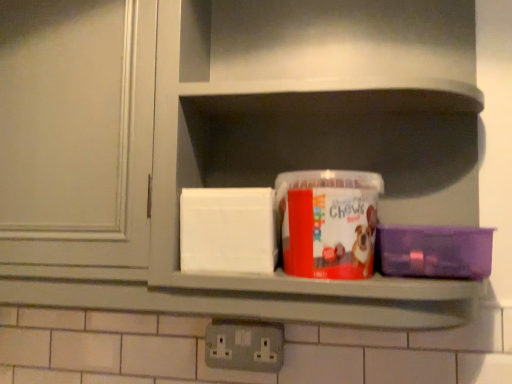
The height and width of the screenshot is (384, 512). What do you see at coordinates (329, 222) in the screenshot?
I see `translucent plastic container at center, which is the 2th box in right-to-left order` at bounding box center [329, 222].

Find the location of a particular element. The width and height of the screenshot is (512, 384). purple plastic container at right, positioned as the second box in left-to-right order is located at coordinates (434, 251).

Image resolution: width=512 pixels, height=384 pixels. Identify the location of translucent plastic container at center, which is the 2th box in right-to-left order. (329, 222).

Is point (280, 354) closer to viewer compared to point (222, 185)?

Yes, it is in front of point (222, 185).

Is gray plastic electrical outlet at lower center looking in the opposite direction of matte plastic container at center?

No, gray plastic electrical outlet at lower center's orientation is not away from matte plastic container at center.

Would you consider gray plastic electrical outlet at lower center to be distant from matte plastic container at center?

No, gray plastic electrical outlet at lower center is in close proximity to matte plastic container at center.

Considering the relative sizes of matte plastic container at center and translucent plastic container at center, which is the 2th box in right-to-left order, in the image provided, is matte plastic container at center bigger than translucent plastic container at center, which is the 2th box in right-to-left order,?

Yes, matte plastic container at center is bigger than translucent plastic container at center, which is the 2th box in right-to-left order.

Are matte plastic container at center and translucent plastic container at center, which is the 2th box in right-to-left order, far apart?

No.

From a real-world perspective, does matte plastic container at center stand above translucent plastic container at center, the 1th box positioned from the left?

Indeed, from a real-world perspective, matte plastic container at center stands above translucent plastic container at center, the 1th box positioned from the left.

Is matte plastic container at center to the right of gray plastic electrical outlet at lower center from the viewer's perspective?

Correct, you'll find matte plastic container at center to the right of gray plastic electrical outlet at lower center.

Is gray plastic electrical outlet at lower center completely or partially inside matte plastic container at center?

No, gray plastic electrical outlet at lower center is located outside of matte plastic container at center.

Is matte plastic container at center positioned far away from gray plastic electrical outlet at lower center?

matte plastic container at center is actually quite close to gray plastic electrical outlet at lower center.

From the image's perspective, which is below, matte plastic container at center or gray plastic electrical outlet at lower center?

gray plastic electrical outlet at lower center, from the image's perspective.

Based on the photo, could you measure the distance between matte plastic container at center and purple plastic container at right, positioned as the second box in left-to-right order?

matte plastic container at center is 7.55 inches from purple plastic container at right, positioned as the second box in left-to-right order.

Is matte plastic container at center in front of or behind purple plastic container at right, which appears as the 1th box when viewed from the right, in the image?

In the image, matte plastic container at center appears in front of purple plastic container at right, which appears as the 1th box when viewed from the right.

Considering the sizes of matte plastic container at center and purple plastic container at right, positioned as the second box in left-to-right order, in the image, is matte plastic container at center bigger or smaller than purple plastic container at right, positioned as the second box in left-to-right order,?

In the image, matte plastic container at center appears to be larger than purple plastic container at right, positioned as the second box in left-to-right order.

Are matte plastic container at center and purple plastic container at right, which appears as the 1th box when viewed from the right, beside each other?

No, matte plastic container at center is not making contact with purple plastic container at right, which appears as the 1th box when viewed from the right.

From a real-world perspective, relative to matte plastic container at center, is translucent plastic container at center, which is the 2th box in right-to-left order, vertically above or below?

From a real-world perspective, translucent plastic container at center, which is the 2th box in right-to-left order, is physically below matte plastic container at center.

Is translucent plastic container at center, the 1th box positioned from the left, touching matte plastic container at center?

No, translucent plastic container at center, the 1th box positioned from the left, is not with matte plastic container at center.

From the image's perspective, is translucent plastic container at center, which is the 2th box in right-to-left order, positioned above or below matte plastic container at center?

translucent plastic container at center, which is the 2th box in right-to-left order, is situated lower than matte plastic container at center in the image.

Is translucent plastic container at center, which is the 2th box in right-to-left order, turned away from gray plastic electrical outlet at lower center?

translucent plastic container at center, which is the 2th box in right-to-left order, does not have its back to gray plastic electrical outlet at lower center.

Is translucent plastic container at center, which is the 2th box in right-to-left order, at the left side of gray plastic electrical outlet at lower center?

Incorrect, translucent plastic container at center, which is the 2th box in right-to-left order, is not on the left side of gray plastic electrical outlet at lower center.

This screenshot has width=512, height=384. I want to click on electric outlet that appears on the left of translucent plastic container at center, the 1th box positioned from the left, so click(244, 346).

How far apart are translucent plastic container at center, which is the 2th box in right-to-left order, and gray plastic electrical outlet at lower center?

translucent plastic container at center, which is the 2th box in right-to-left order, is 9.00 inches from gray plastic electrical outlet at lower center.

Can gray plastic electrical outlet at lower center be found inside purple plastic container at right, which appears as the 1th box when viewed from the right?

Actually, gray plastic electrical outlet at lower center is outside purple plastic container at right, which appears as the 1th box when viewed from the right.

From the image's perspective, is purple plastic container at right, positioned as the second box in left-to-right order, on top of gray plastic electrical outlet at lower center?

Yes, from the image's perspective, purple plastic container at right, positioned as the second box in left-to-right order, is on top of gray plastic electrical outlet at lower center.

Considering the positions of objects purple plastic container at right, positioned as the second box in left-to-right order, and gray plastic electrical outlet at lower center in the image provided, who is more to the right, purple plastic container at right, positioned as the second box in left-to-right order, or gray plastic electrical outlet at lower center?

purple plastic container at right, positioned as the second box in left-to-right order, is more to the right.

Is purple plastic container at right, positioned as the second box in left-to-right order, oriented away from gray plastic electrical outlet at lower center?

purple plastic container at right, positioned as the second box in left-to-right order, is not turned away from gray plastic electrical outlet at lower center.

Where is `cabinet that appears on the right of gray plastic electrical outlet at lower center`? cabinet that appears on the right of gray plastic electrical outlet at lower center is located at coordinates (314, 163).

The image size is (512, 384). I want to click on cabinet above the translucent plastic container at center, which is the 2th box in right-to-left order (from a real-world perspective), so 314,163.

Which object lies further to the anchor point gray plastic electrical outlet at lower center, translucent plastic container at center, the 1th box positioned from the left, or matte plastic container at center?

matte plastic container at center.

Based on their spatial positions, is purple plastic container at right, positioned as the second box in left-to-right order, or matte plastic container at center further from gray plastic electrical outlet at lower center?

matte plastic container at center.

When comparing their distances from purple plastic container at right, positioned as the second box in left-to-right order, does matte plastic container at center or translucent plastic container at center, which is the 2th box in right-to-left order, seem further?

matte plastic container at center.

When comparing their distances from matte plastic container at center, does translucent plastic container at center, the 1th box positioned from the left, or purple plastic container at right, which appears as the 1th box when viewed from the right, seem further?

purple plastic container at right, which appears as the 1th box when viewed from the right, is positioned further to the anchor matte plastic container at center.

Based on their spatial positions, is matte plastic container at center or purple plastic container at right, which appears as the 1th box when viewed from the right, further from translucent plastic container at center, the 1th box positioned from the left?

matte plastic container at center.

Considering their positions, is translucent plastic container at center, which is the 2th box in right-to-left order, positioned closer to purple plastic container at right, positioned as the second box in left-to-right order, than matte plastic container at center?

Among the two, translucent plastic container at center, which is the 2th box in right-to-left order, is located nearer to purple plastic container at right, positioned as the second box in left-to-right order.

When comparing their distances from purple plastic container at right, which appears as the 1th box when viewed from the right, does gray plastic electrical outlet at lower center or matte plastic container at center seem closer?

Based on the image, matte plastic container at center appears to be nearer to purple plastic container at right, which appears as the 1th box when viewed from the right.

Considering their positions, is purple plastic container at right, positioned as the second box in left-to-right order, positioned closer to matte plastic container at center than gray plastic electrical outlet at lower center?

purple plastic container at right, positioned as the second box in left-to-right order, is positioned closer to the anchor matte plastic container at center.

Where is `box between matte plastic container at center and purple plastic container at right, which appears as the 1th box when viewed from the right, vertically`? box between matte plastic container at center and purple plastic container at right, which appears as the 1th box when viewed from the right, vertically is located at coordinates pyautogui.click(x=329, y=222).

This screenshot has height=384, width=512. I want to click on box located between gray plastic electrical outlet at lower center and purple plastic container at right, positioned as the second box in left-to-right order, in the left-right direction, so click(329, 222).